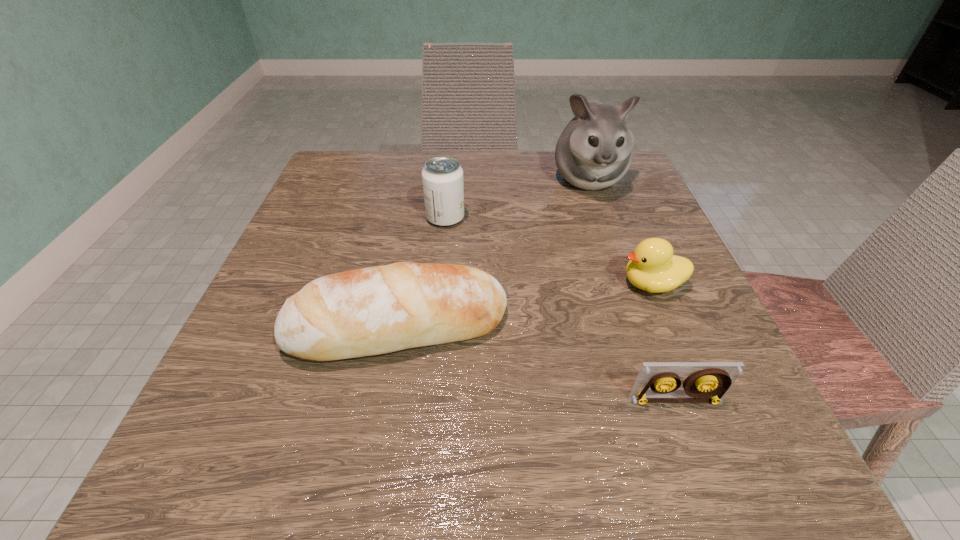
Find the location of `the farthest object`. the farthest object is located at coordinates (594, 151).

Identify the location of the tallest object. (594, 151).

Locate an element on the screen. Image resolution: width=960 pixels, height=540 pixels. soda can is located at coordinates (442, 177).

The width and height of the screenshot is (960, 540). In order to click on bread in this screenshot , I will do `click(376, 310)`.

At what (x,y) coordinates should I click in order to perform the action: click on duckling. Please return your answer as a coordinate pair (x, y). The width and height of the screenshot is (960, 540). Looking at the image, I should click on (652, 267).

Find the location of a particular element. Image resolution: width=960 pixels, height=540 pixels. the nearest object is located at coordinates (708, 382).

Locate an element on the screen. The width and height of the screenshot is (960, 540). the shortest object is located at coordinates (708, 382).

Where is `free location located on the face of the hamster`? This screenshot has width=960, height=540. free location located on the face of the hamster is located at coordinates (614, 255).

Locate an element on the screen. Image resolution: width=960 pixels, height=540 pixels. vacant space situated on the right of the fourth nearest object is located at coordinates (641, 218).

You are a GUI agent. You are given a task and a screenshot of the screen. Output one action in this format:
    pyautogui.click(x=<x>, y=<y>)
    Task: Click on the free spot located 0.050m on the right of the bread
    This screenshot has width=960, height=540.
    Given the screenshot: What is the action you would take?
    pyautogui.click(x=540, y=327)